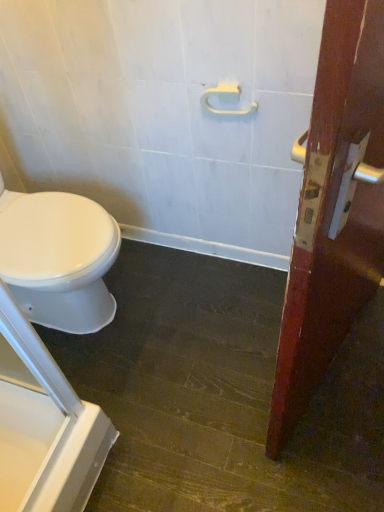
The width and height of the screenshot is (384, 512). I want to click on free spot to the left of wooden door at right, so click(196, 376).